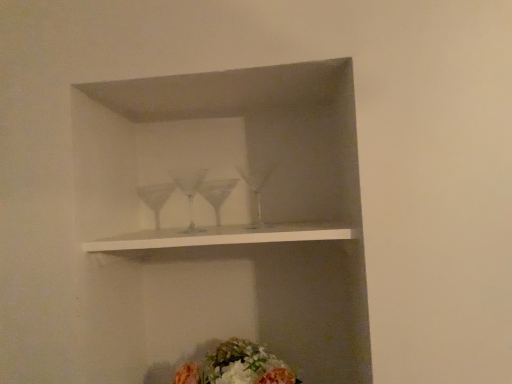
Question: Would you say fluffy floral bouquet at lower center is a long distance from white matte shelf at center?

Choices:
 (A) yes
 (B) no

Answer: (B)

Question: Is fluffy floral bouquet at lower center behind white matte shelf at center?

Choices:
 (A) no
 (B) yes

Answer: (B)

Question: Considering the relative sizes of fluffy floral bouquet at lower center and white matte shelf at center in the image provided, is fluffy floral bouquet at lower center taller than white matte shelf at center?

Choices:
 (A) yes
 (B) no

Answer: (A)

Question: Is fluffy floral bouquet at lower center surrounding white matte shelf at center?

Choices:
 (A) yes
 (B) no

Answer: (B)

Question: Does fluffy floral bouquet at lower center lie in front of white matte shelf at center?

Choices:
 (A) no
 (B) yes

Answer: (A)

Question: From the image's perspective, is fluffy floral bouquet at lower center located beneath white matte shelf at center?

Choices:
 (A) yes
 (B) no

Answer: (A)

Question: Considering the relative positions of white matte shelf at center and fluffy floral bouquet at lower center in the image provided, is white matte shelf at center in front of fluffy floral bouquet at lower center?

Choices:
 (A) no
 (B) yes

Answer: (B)

Question: Is white matte shelf at center shorter than fluffy floral bouquet at lower center?

Choices:
 (A) yes
 (B) no

Answer: (A)

Question: Considering the relative positions of white matte shelf at center and fluffy floral bouquet at lower center in the image provided, is white matte shelf at center to the right of fluffy floral bouquet at lower center from the viewer's perspective?

Choices:
 (A) yes
 (B) no

Answer: (B)

Question: Is white matte shelf at center facing away from fluffy floral bouquet at lower center?

Choices:
 (A) no
 (B) yes

Answer: (A)

Question: Is the depth of white matte shelf at center greater than that of fluffy floral bouquet at lower center?

Choices:
 (A) no
 (B) yes

Answer: (A)

Question: Can fluffy floral bouquet at lower center be found inside white matte shelf at center?

Choices:
 (A) no
 (B) yes

Answer: (A)

Question: Considering the positions of fluffy floral bouquet at lower center and white matte shelf at center in the image, is fluffy floral bouquet at lower center taller or shorter than white matte shelf at center?

Choices:
 (A) short
 (B) tall

Answer: (B)